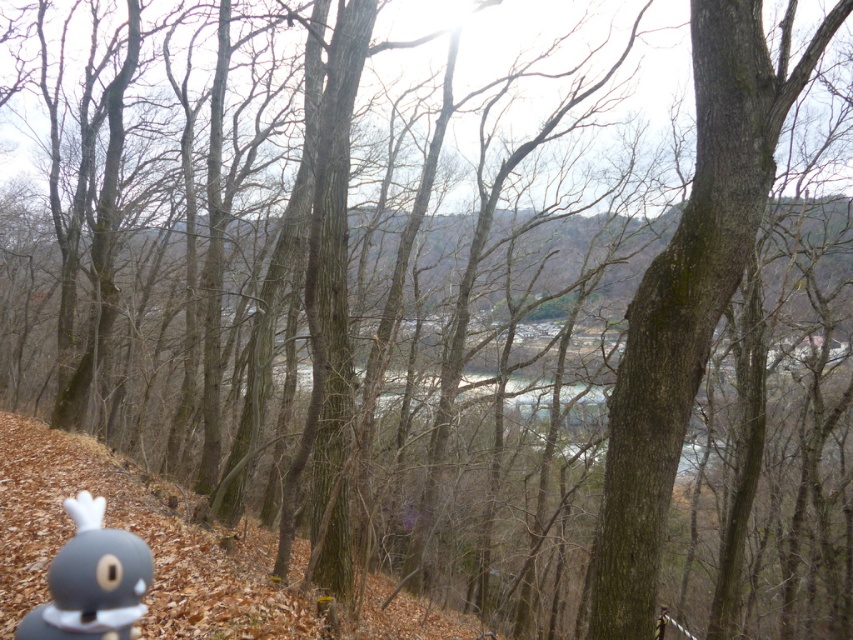
You are a hiker who wants to place a 3.5 meter long tent between the brown rough bark tree at center and the gray matte toy at lower left. Can you fit the tent there?

The distance between the brown rough bark tree at center and the gray matte toy at lower left is 4.56 meters, which is greater than the tent length of 3.5 meters. Therefore, the tent can be placed between them.

You are standing in the forest scene described. There is a point at coordinate (689, 292). What object is this point located on?

The point at coordinate (689, 292) is located on the brown rough bark tree at center.